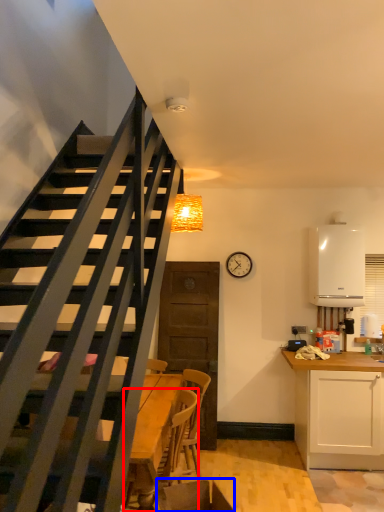
Question: Which point is closer to the camera, chair (highlighted by a red box) or swivel chair (highlighted by a blue box)?

Choices:
 (A) chair
 (B) swivel chair

Answer: (B)